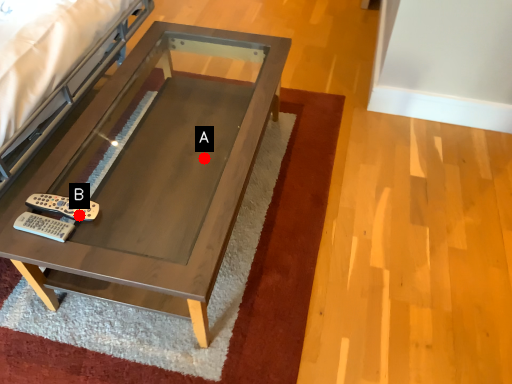
Question: Two points are circled on the image, labeled by A and B beside each circle. Which point appears farthest from the camera in this image?

Choices:
 (A) A is further
 (B) B is further

Answer: (A)